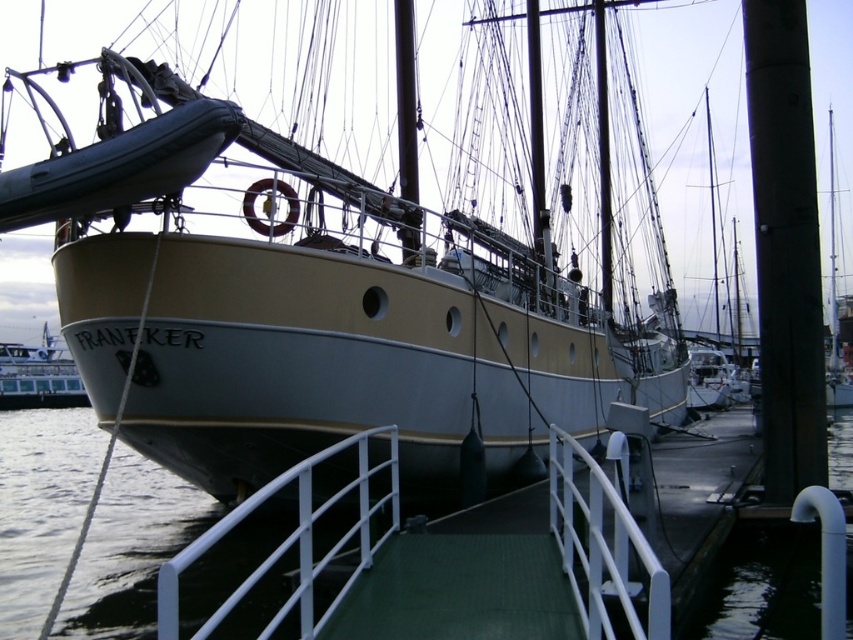
Is white matte rail at center smaller than white glossy ferry at lower left?

Yes, white matte rail at center is smaller than white glossy ferry at lower left.

Identify the location of white matte rail at center. (602, 547).

Is white matte rail at center thinner than white matte rail at lower center?

No, white matte rail at center is not thinner than white matte rail at lower center.

Does white matte rail at center have a greater width compared to white matte rail at lower center?

Yes.

What do you see at coordinates (602, 547) in the screenshot? This screenshot has width=853, height=640. I see `white matte rail at center` at bounding box center [602, 547].

Where is `white matte rail at center`? The image size is (853, 640). white matte rail at center is located at coordinates (602, 547).

Between white matte rail at lower center and white glossy ferry at lower left, which one has more height?

With more height is white glossy ferry at lower left.

Find the location of a particular element. Image resolution: width=853 pixels, height=640 pixels. white matte rail at lower center is located at coordinates (285, 540).

You are a GUI agent. You are given a task and a screenshot of the screen. Output one action in this format:
    pyautogui.click(x=<x>, y=<y>)
    Task: Click on the white matte rail at lower center
    
    Given the screenshot: What is the action you would take?
    pyautogui.click(x=285, y=540)